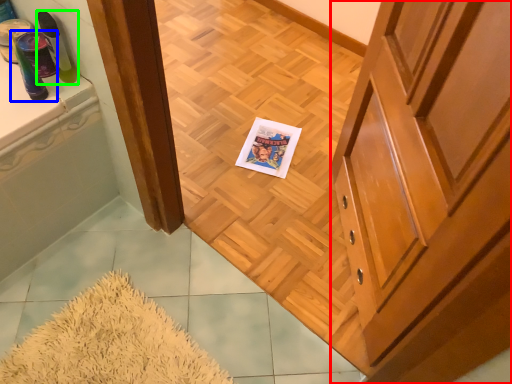
Question: Considering the real-world distances, which object is farthest from cabinetry (highlighted by a red box)? toiletry (highlighted by a blue box) or toiletry (highlighted by a green box)?

Choices:
 (A) toiletry
 (B) toiletry

Answer: (A)